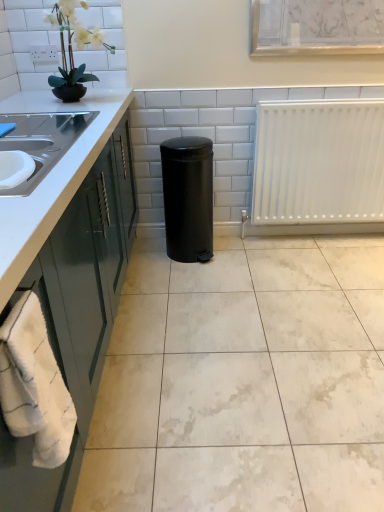
This screenshot has height=512, width=384. Describe the element at coordinates (34, 385) in the screenshot. I see `white fluffy bath towel at lower left` at that location.

The height and width of the screenshot is (512, 384). I want to click on black matte trash can at center, so click(188, 197).

What is the approximate height of black matte trash can at center?

black matte trash can at center is 27.75 inches tall.

Find the location of `white matte radiator at right`. white matte radiator at right is located at coordinates (318, 167).

You are a GUI agent. You are given a task and a screenshot of the screen. Output one action in this format:
    pyautogui.click(x=<x>, y=<y>)
    Task: Click on the matte black pot at upper left
    The width and height of the screenshot is (384, 512).
    Given the screenshot: What is the action you would take?
    pyautogui.click(x=72, y=51)

This screenshot has height=512, width=384. Describe the element at coordinates (64, 280) in the screenshot. I see `white glossy countertop at left` at that location.

You are a GUI agent. You are given a task and a screenshot of the screen. Output one action in this format:
    pyautogui.click(x=<x>, y=<y>)
    Task: Click on the white fluffy bath towel at lower left
    
    Given the screenshot: What is the action you would take?
    (x=34, y=385)

How distant is white matte radiator at right from white glossy countertop at left?

They are 4.22 feet apart.

From the picture: Considering the relative sizes of white matte radiator at right and white glossy countertop at left in the image provided, is white matte radiator at right smaller than white glossy countertop at left?

Yes.

Is there a large distance between white matte radiator at right and white glossy countertop at left?

white matte radiator at right is far away from white glossy countertop at left.

Considering the positions of point (255, 191) and point (85, 400), is point (255, 191) closer or farther from the camera than point (85, 400)?

Clearly, point (255, 191) is more distant from the camera than point (85, 400).

Between white glossy tile at center and white matte radiator at right, which one has larger width?

white glossy tile at center.

From the image's perspective, is white glossy tile at center located above white matte radiator at right?

Incorrect, from the image's perspective, white glossy tile at center is lower than white matte radiator at right.

Is white glossy tile at center positioned far away from white matte radiator at right?

That's not correct — white glossy tile at center is a little close to white matte radiator at right.

Is white glossy tile at center looking in the opposite direction of white matte radiator at right?

No, white matte radiator at right is not at the back of white glossy tile at center.

Between point (29, 371) and point (316, 225), which one is positioned behind?

The point (316, 225) is behind.

Is white fluffy bath towel at lower left taller than white matte radiator at right?

No, white fluffy bath towel at lower left is not taller than white matte radiator at right.

Is white matte radiator at right a part of white fluffy bath towel at lower left?

No, white matte radiator at right is located outside of white fluffy bath towel at lower left.

Considering the relative sizes of white fluffy bath towel at lower left and white matte radiator at right in the image provided, is white fluffy bath towel at lower left wider than white matte radiator at right?

Incorrect, the width of white fluffy bath towel at lower left does not surpass that of white matte radiator at right.

Based on the photo, which object is thinner, matte black pot at upper left or white glossy tile at center?

With smaller width is matte black pot at upper left.

Who is more distant, matte black pot at upper left or white glossy tile at center?

Positioned behind is matte black pot at upper left.

What's the angular difference between matte black pot at upper left and white glossy tile at center's facing directions?

39.9 degrees.

What are the coordinates of `ceramic tile below the matte black pot at upper left (from the image's perspective)` in the screenshot? It's located at (243, 381).

Does white glossy countertop at left have a greater width compared to white fluffy bath towel at lower left?

Correct, the width of white glossy countertop at left exceeds that of white fluffy bath towel at lower left.

From the image's perspective, between white glossy countertop at left and white fluffy bath towel at lower left, which one is located above?

From the image's view, white glossy countertop at left is above.

Which object is positioned more to the right, white glossy countertop at left or white fluffy bath towel at lower left?

white fluffy bath towel at lower left is more to the right.

Is white glossy countertop at left next to white fluffy bath towel at lower left and touching it?

No, white glossy countertop at left is not beside white fluffy bath towel at lower left.

Which of these two, black matte trash can at center or white glossy tile at center, stands shorter?

white glossy tile at center.

Is black matte trash can at center wider than white glossy tile at center?

No, black matte trash can at center is not wider than white glossy tile at center.

Does black matte trash can at center have a smaller size compared to white glossy tile at center?

Yes, black matte trash can at center is smaller than white glossy tile at center.

Who is more distant, white fluffy bath towel at lower left or white glossy tile at center?

white glossy tile at center is further from the camera.

Can we say white fluffy bath towel at lower left lies outside white glossy tile at center?

Yes, white fluffy bath towel at lower left is not within white glossy tile at center.

From the image's perspective, relative to white glossy tile at center, is white fluffy bath towel at lower left above or below?

Clearly, from the image's perspective, white fluffy bath towel at lower left is below white glossy tile at center.

How distant is white fluffy bath towel at lower left from white glossy tile at center?

white fluffy bath towel at lower left and white glossy tile at center are 88.21 centimeters apart from each other.

Identify the location of countertop that is under the white matte radiator at right (from a real-world perspective). Image resolution: width=384 pixels, height=512 pixels. (64, 280).

What are the coordinates of `ceramic tile that appears in front of the white matte radiator at right` in the screenshot? It's located at (243, 381).

Based on their spatial positions, is white glossy countertop at left or white matte radiator at right closer to white glossy tile at center?

white glossy countertop at left is closer to white glossy tile at center.

When comparing their distances from white glossy countertop at left, does white matte radiator at right or white glossy tile at center seem closer?

white glossy tile at center is closer to white glossy countertop at left.

Looking at the image, which one is located further to white glossy tile at center, white fluffy bath towel at lower left or white glossy countertop at left?

The object further to white glossy tile at center is white fluffy bath towel at lower left.

Estimate the real-world distances between objects in this image. Which object is closer to white glossy countertop at left, white matte radiator at right or black matte trash can at center?

black matte trash can at center lies closer to white glossy countertop at left than the other object.

From the image, which object appears to be farther from white matte radiator at right, white glossy countertop at left or black matte trash can at center?

white glossy countertop at left is further to white matte radiator at right.

Which object lies further to the anchor point black matte trash can at center, white fluffy bath towel at lower left or white glossy tile at center?

white fluffy bath towel at lower left.

Estimate the real-world distances between objects in this image. Which object is closer to white matte radiator at right, matte black pot at upper left or white glossy tile at center?

white glossy tile at center is closer to white matte radiator at right.

From the picture: From the image, which object appears to be nearer to white glossy tile at center, black matte trash can at center or white matte radiator at right?

black matte trash can at center lies closer to white glossy tile at center than the other object.

Identify the location of countertop that lies between matte black pot at upper left and white glossy tile at center from top to bottom. (64, 280).

This screenshot has height=512, width=384. I want to click on appliance located between white glossy countertop at left and white matte radiator at right in the depth direction, so click(x=188, y=197).

The image size is (384, 512). In order to click on bath towel situated between white glossy countertop at left and white glossy tile at center from left to right in this screenshot , I will do `click(34, 385)`.

The height and width of the screenshot is (512, 384). I want to click on houseplant positioned between white glossy countertop at left and white matte radiator at right from near to far, so click(72, 51).